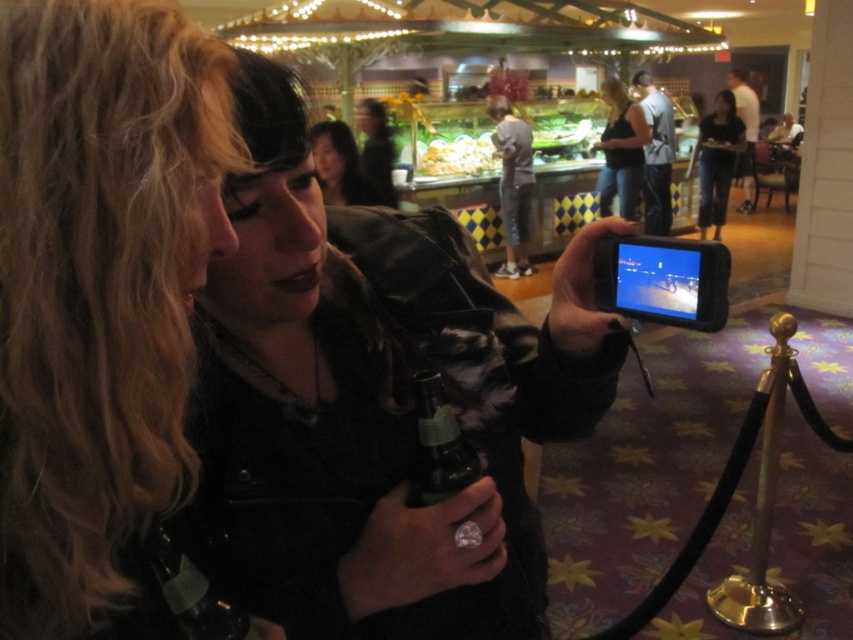
You are a fashion designer observing the two black garments in the image. The matte black jacket at center and the matte black tank top at center. Which one is positioned lower on the person?

The matte black jacket at center is positioned lower because it is below the matte black tank top at center.

You are a fashion designer observing the person in the image. You notice the matte black tank top at center and dark blue jeans at center. Which clothing item appears narrower in width?

The matte black tank top at center has a lesser width compared to the dark blue jeans at center, so the matte black tank top at center appears narrower in width.

You are standing at the origin of the coordinate system in the image. You want to walk to the point at [712,205] but there is an obstacle at point [605,83]. Will you encounter the obstacle before reaching your destination?

Yes, you will encounter the obstacle at point [605,83] before reaching your destination at point [712,205] because point [605,83] is in front of point [712,205].